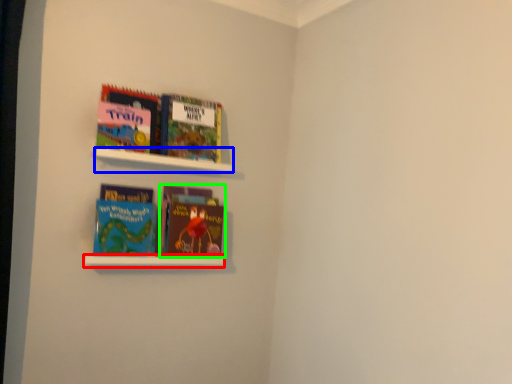
Question: Considering the real-world distances, which object is closest to cabinet (highlighted by a red box)? cabinet (highlighted by a blue box) or book (highlighted by a green box).

Choices:
 (A) cabinet
 (B) book

Answer: (B)